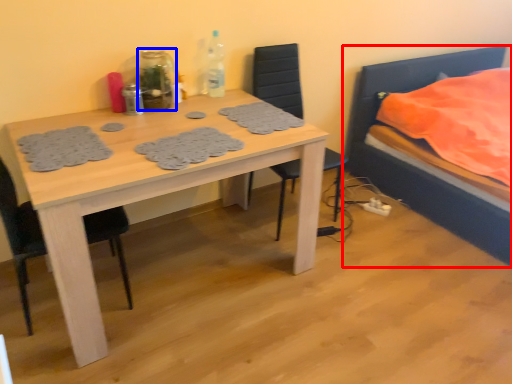
Question: Which point is further to the camera, bed (highlighted by a red box) or bottle (highlighted by a blue box)?

Choices:
 (A) bed
 (B) bottle

Answer: (B)